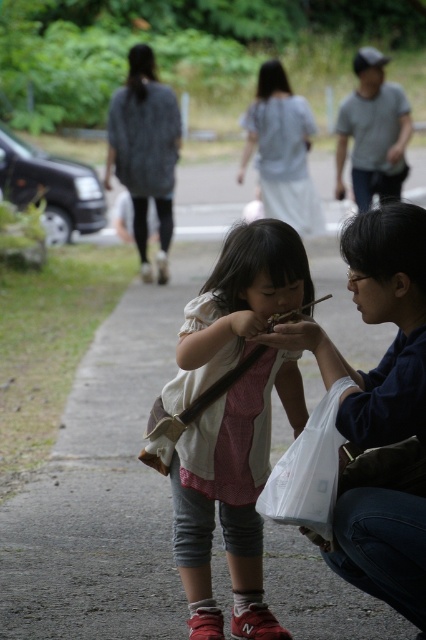
You are a photographer trying to capture a clear shot of the light gray cotton shirt at center without the white plastic bag at center blocking it. What should you do?

Move the camera position to the side so that the light gray cotton shirt at center is no longer behind the white plastic bag at center.